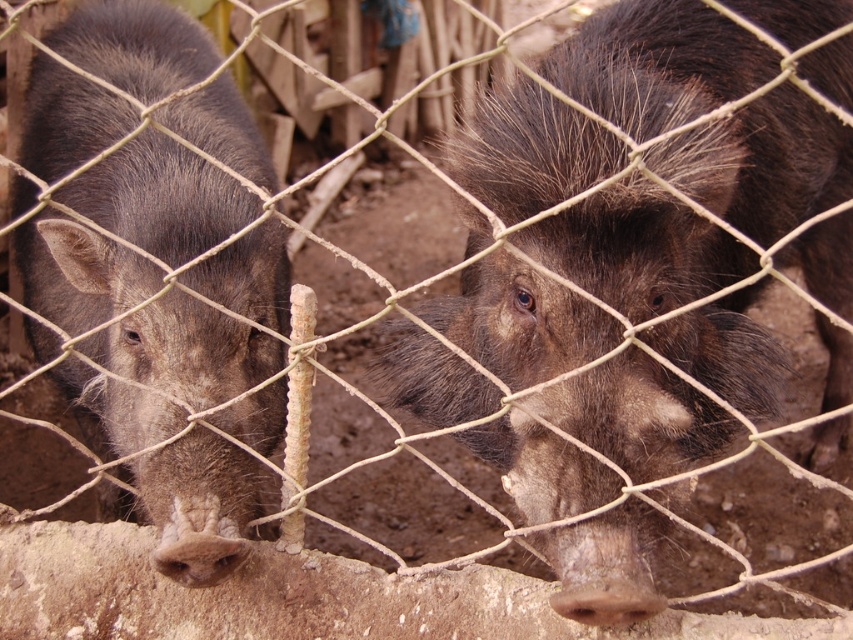
Question: Among these objects, which one is farthest from the camera?

Choices:
 (A) brown fuzzy pig at center
 (B) dark brown fur at left

Answer: (B)

Question: Is brown fuzzy pig at center positioned behind dark brown fur at left?

Choices:
 (A) yes
 (B) no

Answer: (B)

Question: Which of the following is the closest to the observer?

Choices:
 (A) brown fuzzy pig at center
 (B) dark brown fur at left

Answer: (A)

Question: Observing the image, what is the correct spatial positioning of brown fuzzy pig at center in reference to dark brown fur at left?

Choices:
 (A) left
 (B) right

Answer: (B)

Question: Among these points, which one is nearest to the camera?

Choices:
 (A) (223, 298)
 (B) (717, 179)

Answer: (B)

Question: Where is brown fuzzy pig at center located in relation to dark brown fur at left in the image?

Choices:
 (A) right
 (B) left

Answer: (A)